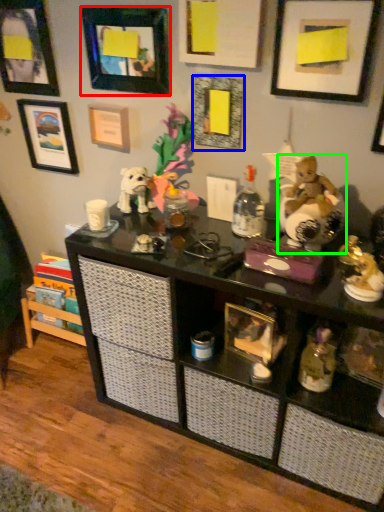
Question: Based on their relative distances, which object is nearer to picture frame (highlighted by a red box)? Choose from picture frame (highlighted by a blue box) and toy (highlighted by a green box).

Choices:
 (A) picture frame
 (B) toy

Answer: (A)